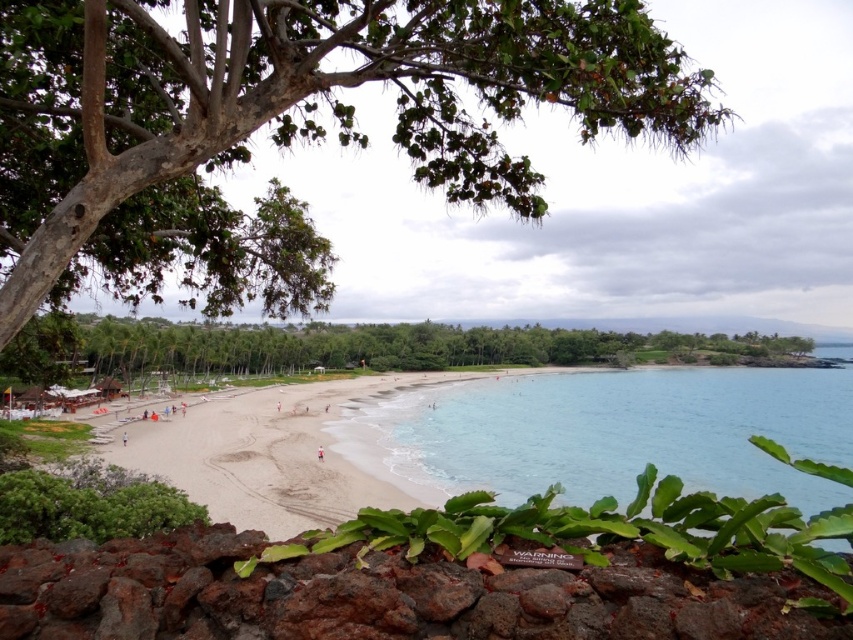
Question: Can you confirm if clear blue water at center is wider than green leafy tree at center?

Choices:
 (A) no
 (B) yes

Answer: (A)

Question: Does green leafy tree at upper center appear on the right side of clear blue water at center?

Choices:
 (A) no
 (B) yes

Answer: (A)

Question: Which object is positioned farthest from the green leafy tree at center?

Choices:
 (A) green leafy tree at upper center
 (B) white sandy beach at center

Answer: (A)

Question: Which is nearer to the white sandy beach at center?

Choices:
 (A) green leafy tree at center
 (B) clear blue water at center

Answer: (B)

Question: Can you confirm if green leafy tree at upper center is thinner than green leafy tree at center?

Choices:
 (A) no
 (B) yes

Answer: (B)

Question: Which object is the closest to the green leafy tree at upper center?

Choices:
 (A) clear blue water at center
 (B) green leafy tree at center
 (C) white sandy beach at center

Answer: (C)